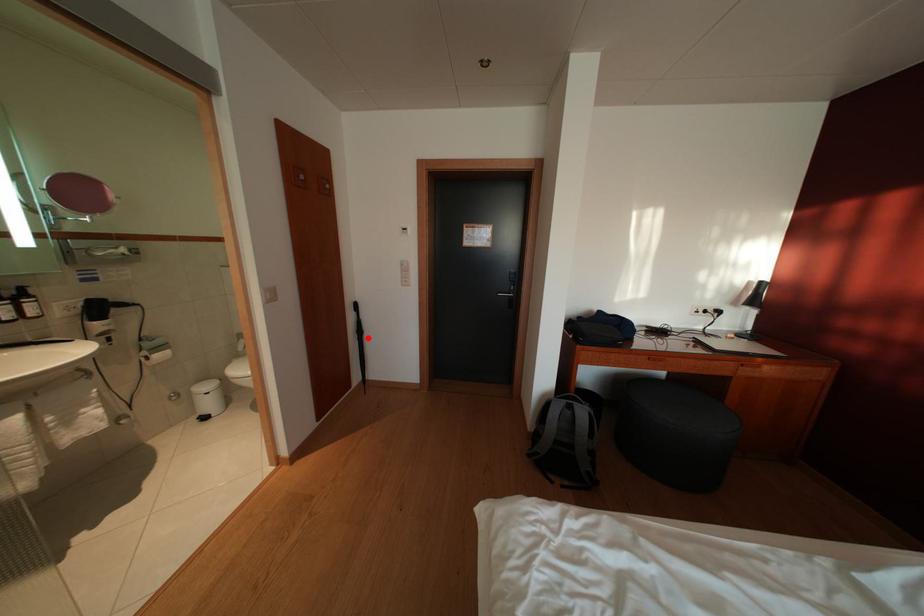
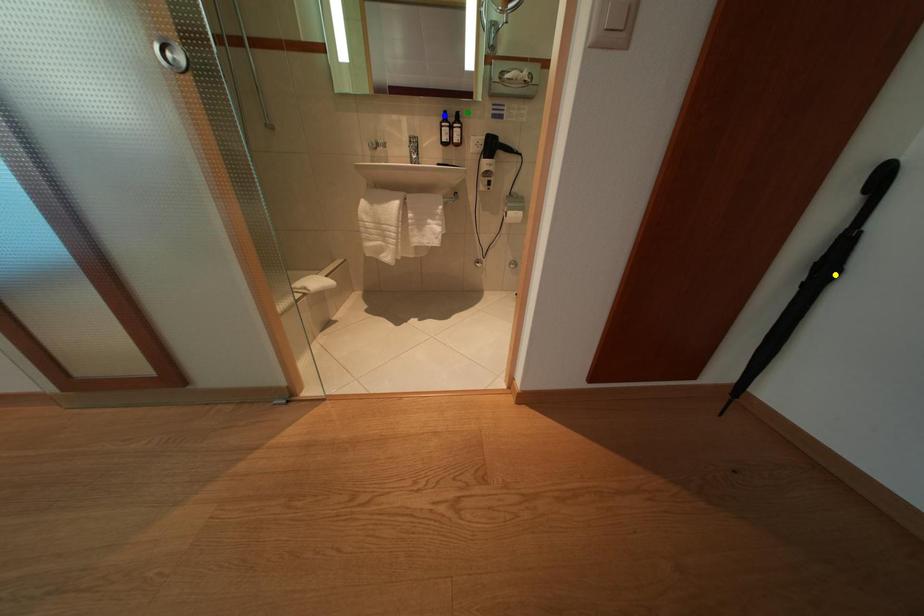
Question: I am providing you with two images of the same scene from different viewpoints. A red point is marked on the first image. You are given multiple points on the second image. In image 2, which mark is for the same physical point as the one in image 1?

Choices:
 (A) blue point
 (B) yellow point
 (C) green point

Answer: (B)